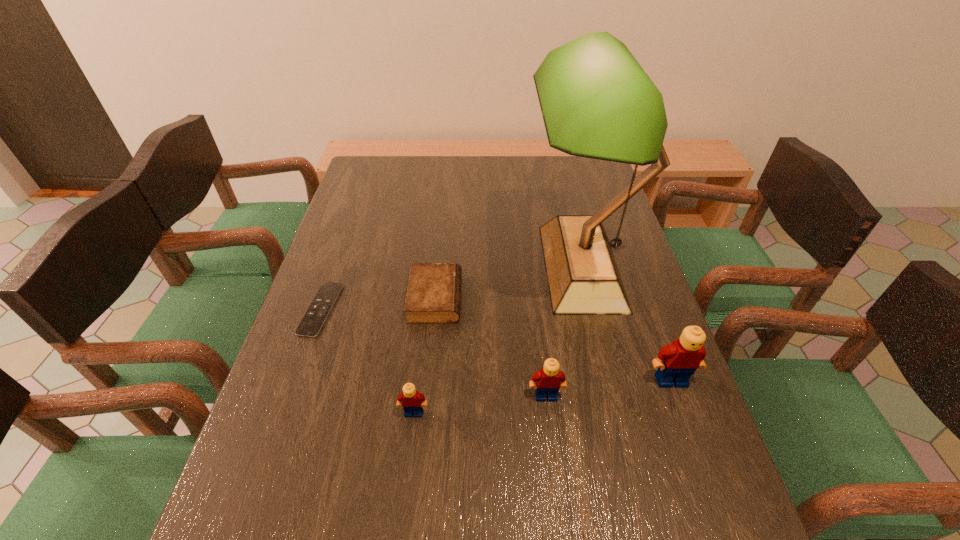
Locate an element on the screen. This screenshot has width=960, height=540. blank region between the shortest object and the tallest Lego is located at coordinates (496, 345).

Locate an element on the screen. The height and width of the screenshot is (540, 960). vacant area between the fifth tallest object and the fifth shortest object is located at coordinates (553, 339).

Locate an element on the screen. This screenshot has height=540, width=960. vacant area that lies between the diary and the second farthest Lego is located at coordinates (491, 347).

Identify the location of free space that is in between the leftmost Lego and the leftmost object. (367, 361).

Find the location of a particular element. free area in between the rightmost Lego and the second nearest object is located at coordinates (609, 388).

Find the location of `the second closest object to the second shortest Lego`. the second closest object to the second shortest Lego is located at coordinates (597, 102).

At what (x,y) coordinates should I click in order to perform the action: click on the second closest object to the second farthest Lego. Please return your answer as a coordinate pair (x, y). The image size is (960, 540). Looking at the image, I should click on (597, 102).

The height and width of the screenshot is (540, 960). Identify the location of Lego that is the nearest to the table lamp. (676, 362).

Choose which Lego is the nearest neighbor to the diary. Please provide its 2D coordinates. Your answer should be formatted as a tuple, i.e. [(x, y)], where the tuple contains the x and y coordinates of a point satisfying the conditions above.

[(411, 401)]

This screenshot has width=960, height=540. In order to click on vacant space that satisfies the following two spatial constraints: 1. on the metallic stand of the table lamp; 2. on the front-facing side of the second tallest Lego in this screenshot , I will do click(x=612, y=396).